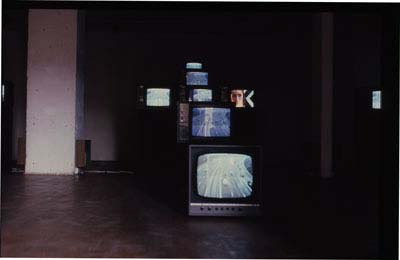
At what (x,y) coordinates should I click in order to perform the action: click on ceiling. Please return your answer as a coordinate pair (x, y). The image size is (400, 260). Looking at the image, I should click on (107, 2).